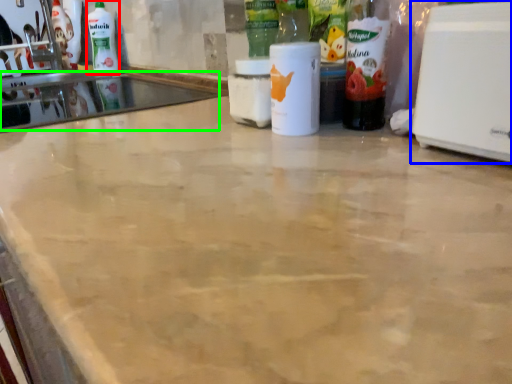
Question: Which object is the farthest from cleaning product (highlighted by a red box)? Choose among these: home appliance (highlighted by a blue box) or sink (highlighted by a green box).

Choices:
 (A) home appliance
 (B) sink

Answer: (A)